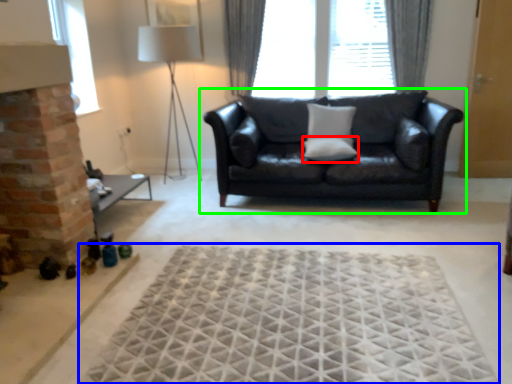
Question: Considering the real-world distances, which object is closest to pillow (highlighted by a red box)? mat (highlighted by a blue box) or studio couch (highlighted by a green box).

Choices:
 (A) mat
 (B) studio couch

Answer: (B)